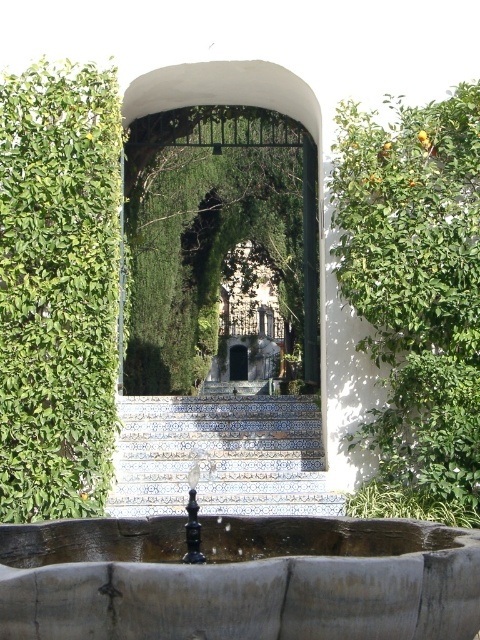
You are a gardener who needs to place a 12 meter long decorative fence between the green leafy archway at center and the blue tile stairs at center. Will the fence fit in the space between them?

The distance between the green leafy archway at center and the blue tile stairs at center is 11.91 meters. Since the fence is 12 meters long, it will not fit in the space between them as the available space is slightly shorter than the fence.

You are a gardener who wants to trim the green leafy hedge at right and the green leafy archway at center. Which one is closer to the right edge of the garden?

The green leafy hedge at right is positioned on the right side of the green leafy archway at center, so the green leafy hedge at right is closer to the right edge of the garden.